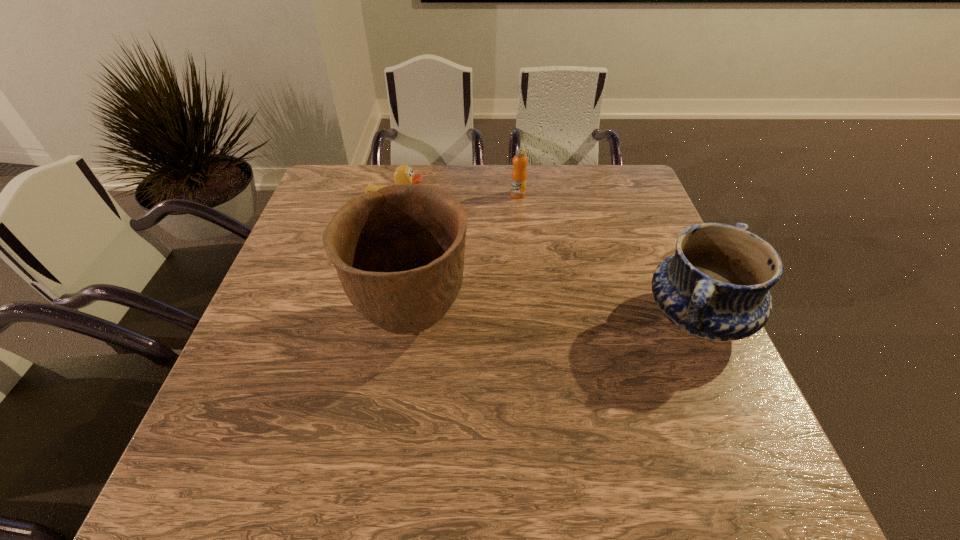
Where is `vacant space at the right edge`? vacant space at the right edge is located at coordinates (638, 335).

Where is `free region at the far left corner`? The image size is (960, 540). free region at the far left corner is located at coordinates (374, 173).

You are a GUI agent. You are given a task and a screenshot of the screen. Output one action in this format:
    pyautogui.click(x=<x>, y=<y>)
    Task: Click on the free spot at the near left corner of the desktop
    
    Given the screenshot: What is the action you would take?
    pyautogui.click(x=226, y=421)

The height and width of the screenshot is (540, 960). In the image, there is a desktop. What are the coordinates of `free region at the far right corner` in the screenshot? It's located at (643, 200).

The height and width of the screenshot is (540, 960). I want to click on free region at the near right corner of the desktop, so click(703, 390).

At what (x,y) coordinates should I click in order to perform the action: click on vacant area between the farthest object and the right pottery. Please return your answer as a coordinate pair (x, y). This screenshot has width=960, height=540. Looking at the image, I should click on (607, 256).

You are a GUI agent. You are given a task and a screenshot of the screen. Output one action in this format:
    pyautogui.click(x=<x>, y=<y>)
    Task: Click on the empty location between the rightmost object and the orange juice
    This screenshot has height=540, width=960.
    Given the screenshot: What is the action you would take?
    [x=607, y=256]

This screenshot has height=540, width=960. Find the location of `free area in between the farthest object and the tallest object`. free area in between the farthest object and the tallest object is located at coordinates (465, 258).

Where is `free point between the left pottery and the rightmost object`? The width and height of the screenshot is (960, 540). free point between the left pottery and the rightmost object is located at coordinates (554, 319).

I want to click on free space between the third nearest object and the third shortest object, so click(547, 263).